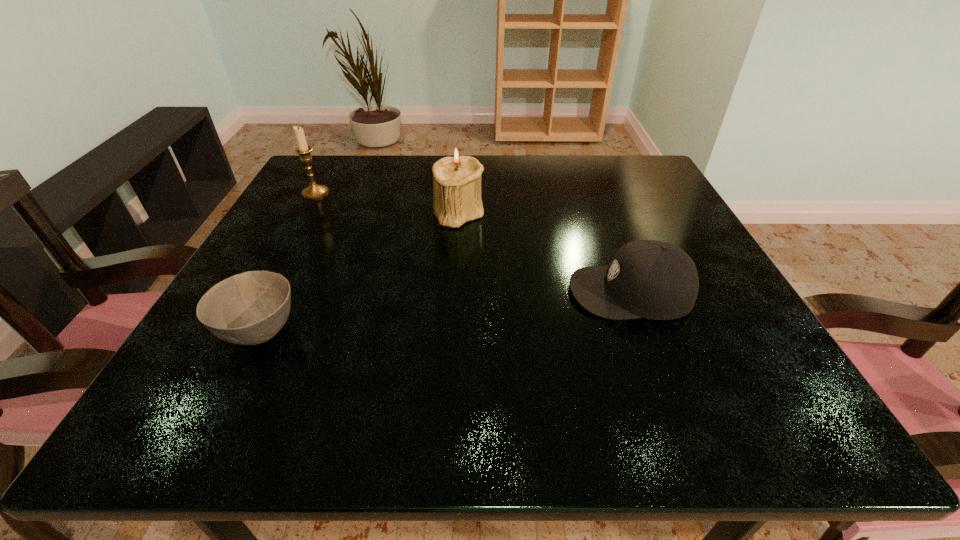
Locate an element on the screen. free area in between the third object from left to right and the rightmost object is located at coordinates (544, 252).

Locate an element on the screen. vacant space that is in between the second object from right to left and the third tallest object is located at coordinates (544, 252).

The height and width of the screenshot is (540, 960). I want to click on the second closest object to the bowl, so click(314, 191).

Identify which object is the third closest to the left candle_holder. Please provide its 2D coordinates. Your answer should be formatted as a tuple, i.e. [(x, y)], where the tuple contains the x and y coordinates of a point satisfying the conditions above.

[(651, 279)]

You are a GUI agent. You are given a task and a screenshot of the screen. Output one action in this format:
    pyautogui.click(x=<x>, y=<y>)
    Task: Click on the vacant space that satisfies the following two spatial constraints: 1. on the front-facing side of the rightmost object; 2. on the front side of the shortest object
    This screenshot has width=960, height=540.
    Given the screenshot: What is the action you would take?
    [646, 332]